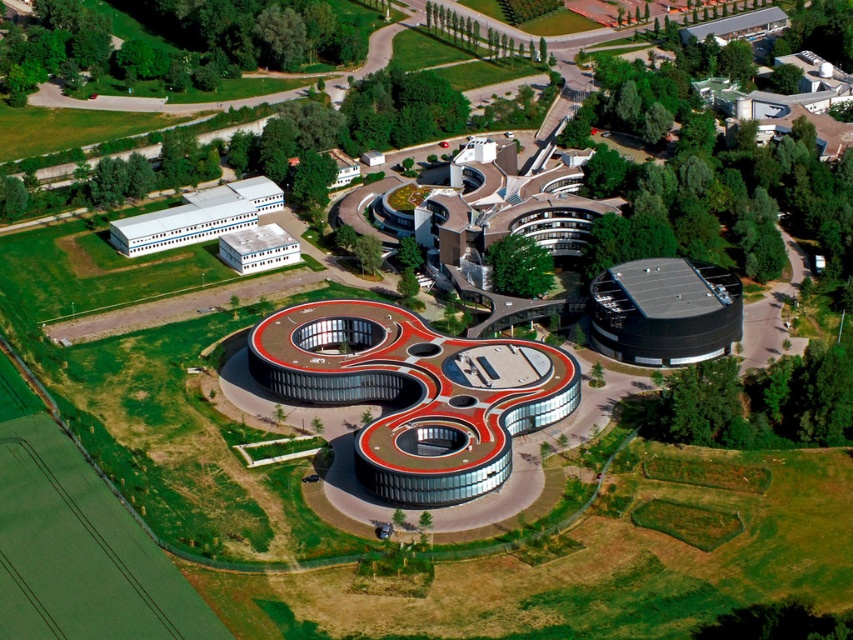
Which is more to the right, glassy white building at center or white matte building at left?

From the viewer's perspective, glassy white building at center appears more on the right side.

Which is behind, point (494, 483) or point (242, 179)?

Point (242, 179)

Image resolution: width=853 pixels, height=640 pixels. I want to click on glassy white building at center, so click(x=415, y=394).

Who is positioned more to the left, black glass dome at right or white matte building at upper left?

From the viewer's perspective, white matte building at upper left appears more on the left side.

Between black glass dome at right and white matte building at upper left, which one appears on the right side from the viewer's perspective?

black glass dome at right is more to the right.

Between point (611, 284) and point (294, 237), which one is positioned behind?

Positioned behind is point (294, 237).

The width and height of the screenshot is (853, 640). I want to click on black glass dome at right, so click(664, 310).

Is glassy white building at center shorter than beige textured building at upper center?

Correct, glassy white building at center is not as tall as beige textured building at upper center.

Does point (354, 304) lie in front of point (531, 173)?

Yes.

Find the location of a particular element. Image resolution: width=853 pixels, height=640 pixels. glassy white building at center is located at coordinates (415, 394).